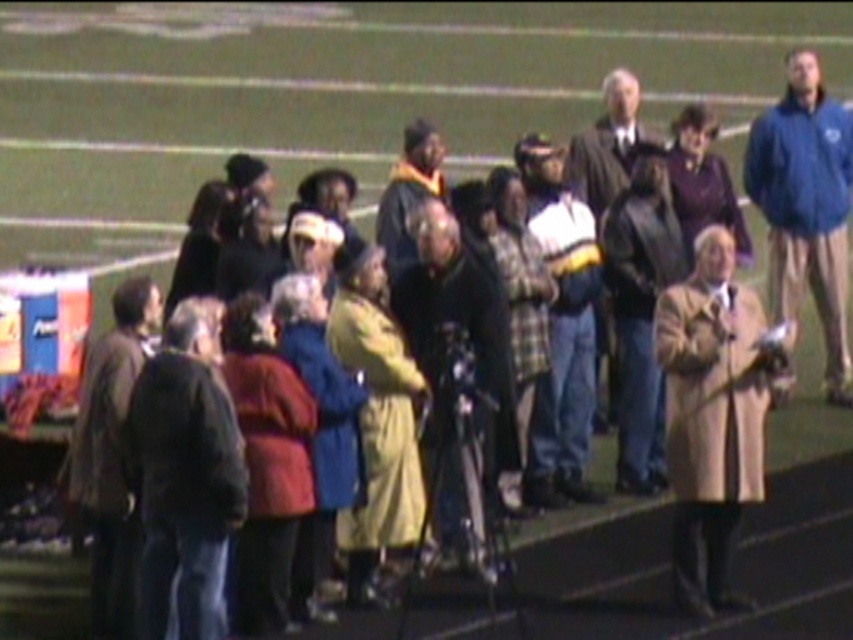
Question: Is black leather jacket at center above matte black graduation gown at center?

Choices:
 (A) yes
 (B) no

Answer: (B)

Question: Which is nearer to the brown leather jacket at left?

Choices:
 (A) black leather jacket at center
 (B) matte black graduation gown at center

Answer: (A)

Question: Can you confirm if black leather jacket at center is wider than matte black graduation gown at center?

Choices:
 (A) no
 (B) yes

Answer: (B)

Question: Which object appears farthest from the camera in this image?

Choices:
 (A) plaid fabric jacket at center
 (B) blue fleece jacket at upper right
 (C) black leather jacket at center
 (D) brown leather jacket at left

Answer: (B)

Question: Which point is farther from the camera taking this photo?

Choices:
 (A) (598, 195)
 (B) (759, 116)
 (C) (410, 305)

Answer: (B)

Question: Can you confirm if brown leather jacket at left is wider than matte black graduation gown at center?

Choices:
 (A) no
 (B) yes

Answer: (B)